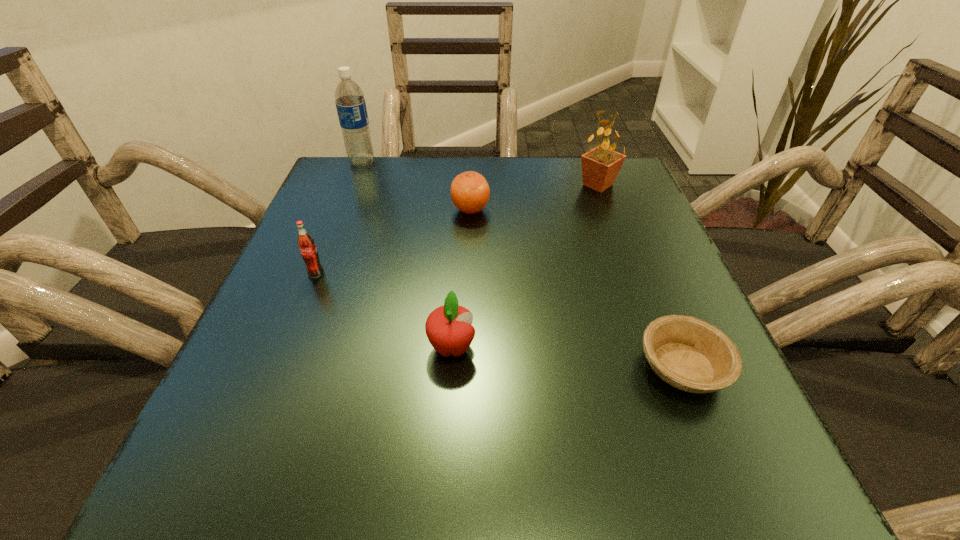
The image size is (960, 540). Find the location of `water bottle located at the left edge`. water bottle located at the left edge is located at coordinates [x=351, y=107].

Find the location of a particular element. The width and height of the screenshot is (960, 540). soda bottle that is at the left edge is located at coordinates (306, 244).

This screenshot has height=540, width=960. I want to click on sunflower that is positioned at the right edge, so click(x=600, y=166).

In order to click on bowl located in the right edge section of the desktop in this screenshot , I will do `click(690, 354)`.

At what (x,y) coordinates should I click in order to perform the action: click on object positioned at the far left corner. Please return your answer as a coordinate pair (x, y). The height and width of the screenshot is (540, 960). Looking at the image, I should click on (351, 107).

Identify the location of object that is at the far right corner. Image resolution: width=960 pixels, height=540 pixels. (600, 166).

Find the location of a particular element. This screenshot has width=960, height=540. blank area at the far edge is located at coordinates (518, 175).

This screenshot has width=960, height=540. I want to click on vacant position at the near edge of the desktop, so click(596, 465).

Where is `vacant point at the left edge`? The image size is (960, 540). vacant point at the left edge is located at coordinates (316, 390).

Locate an element on the screen. vacant space at the right edge of the desktop is located at coordinates (618, 278).